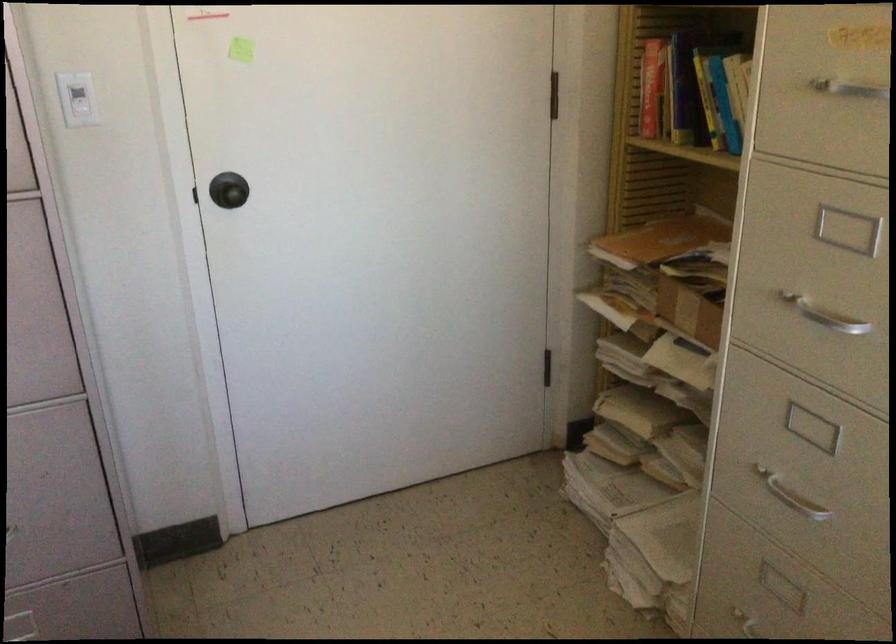
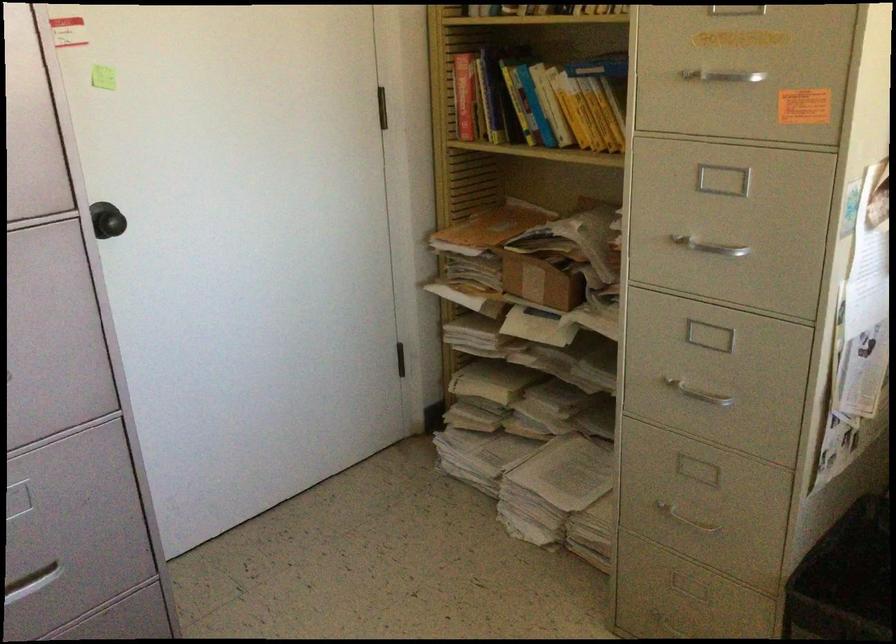
In the second image, find the point that corresponds to the point at 688,310 in the first image.

(539, 281)